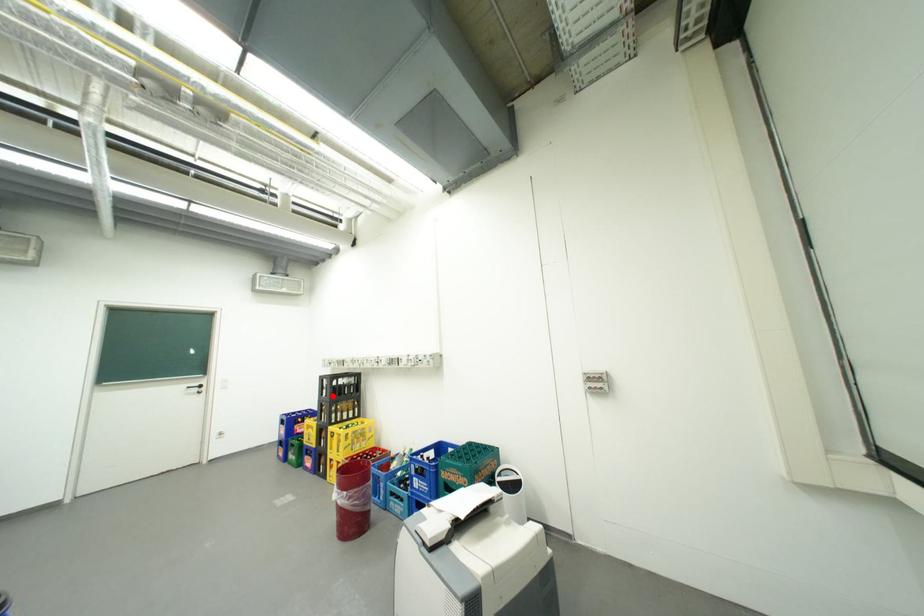
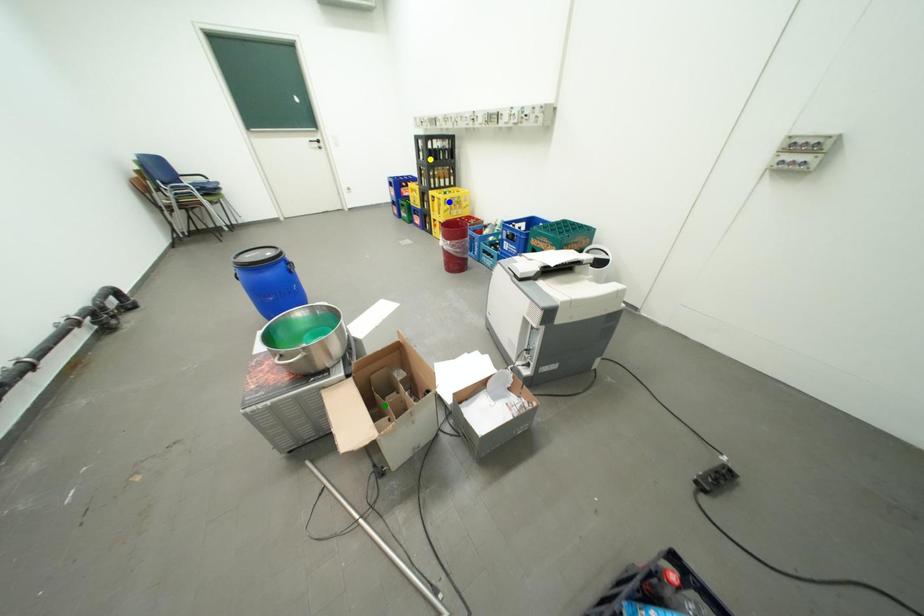
Question: I am providing you with two images of the same scene from different viewpoints. A red point is marked on the first image. You are given multiple points on the second image. Can you choose the point in image 2 that corresponds to the point in image 1?

Choices:
 (A) yellow point
 (B) green point
 (C) blue point

Answer: (A)